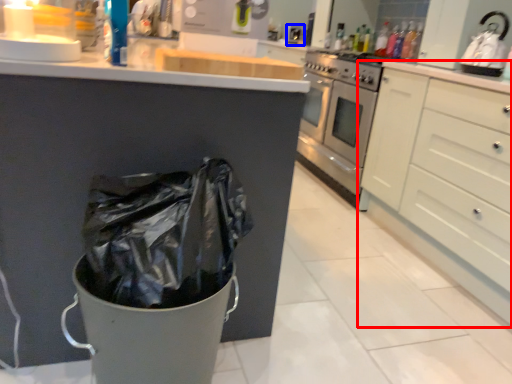
Question: Which object appears farthest to the camera in this image, cabinetry (highlighted by a red box) or sink (highlighted by a blue box)?

Choices:
 (A) cabinetry
 (B) sink

Answer: (B)